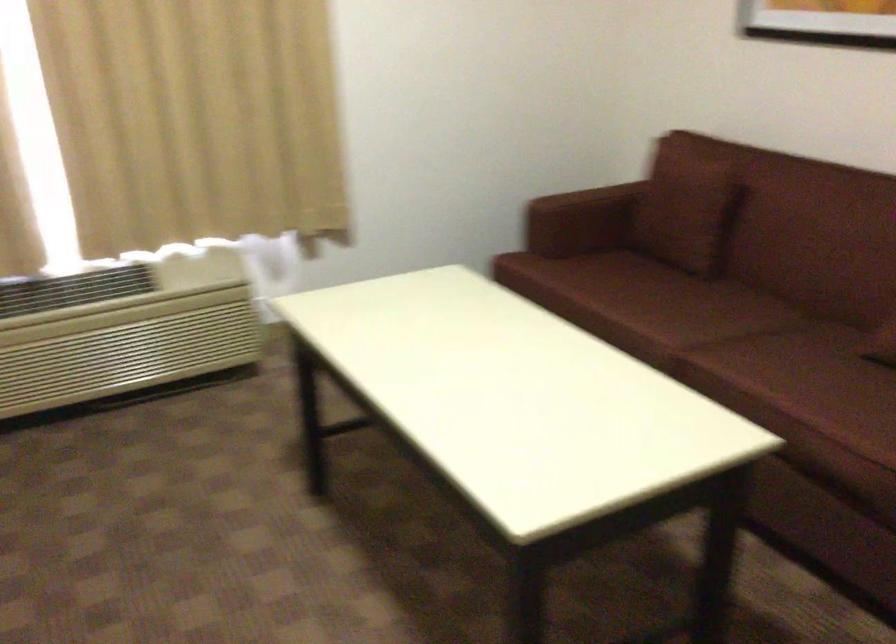
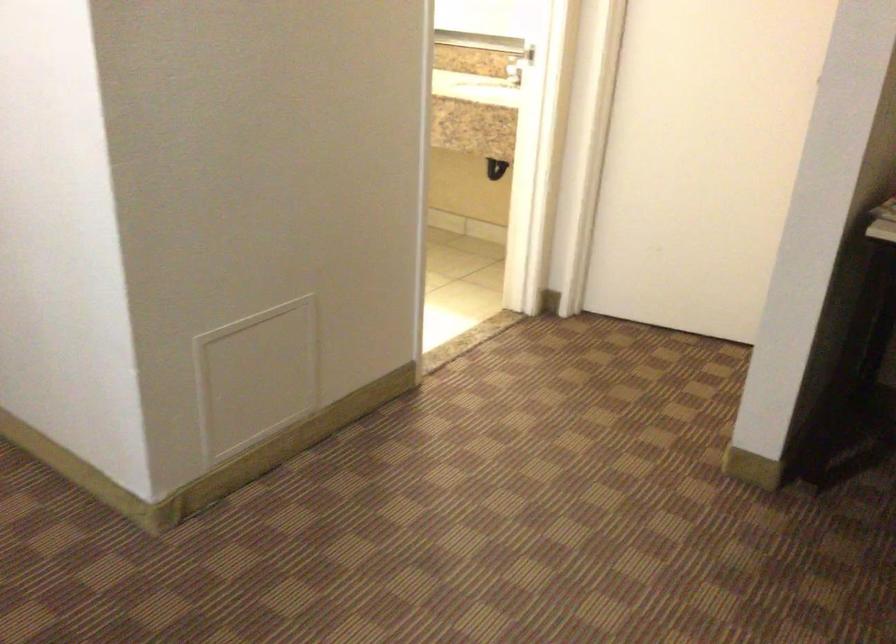
The first image is from the beginning of the video and the second image is from the end. How did the camera likely rotate when shooting the video?

The camera rotated toward right-down.